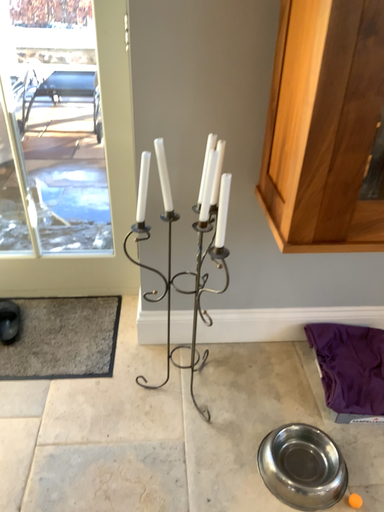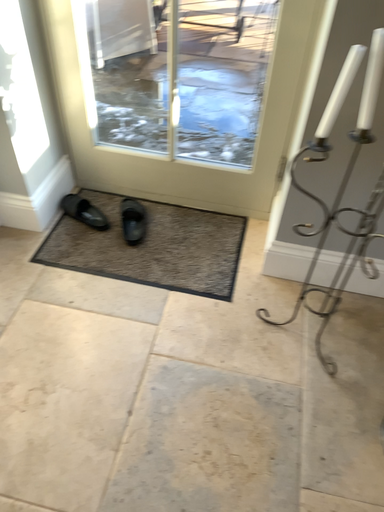
Question: How did the camera likely rotate when shooting the video?

Choices:
 (A) rotated left
 (B) rotated right

Answer: (A)